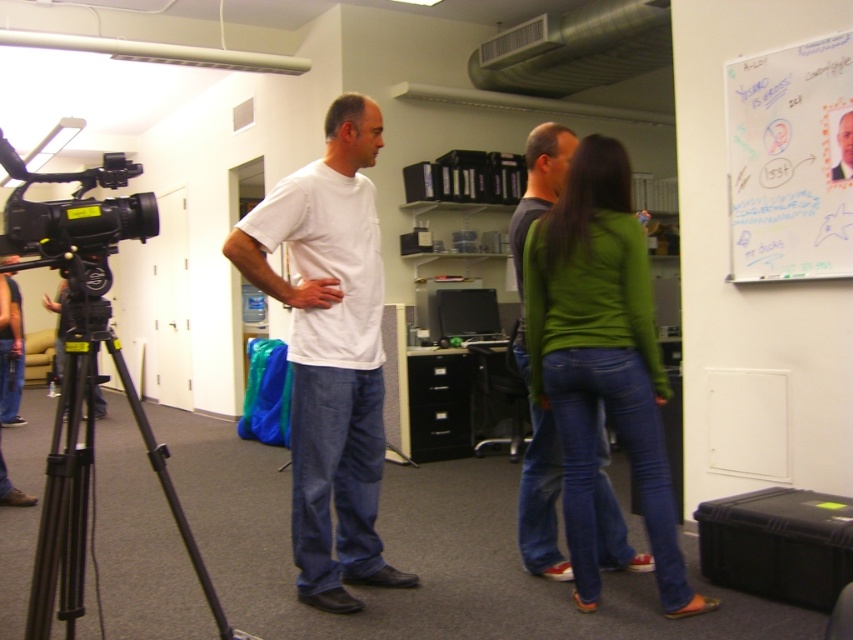
You are setting up a video call in this office and need to place the whiteboard at upper right and the black metal tripod at left in a way that the camera can capture both clearly. Based on their positions, which object is on the right side of the other?

The whiteboard at upper right is positioned on the right side of black metal tripod at left, so the whiteboard is on the right side of the tripod.

You are a photographer adjusting the focus of your camera. You need to focus on two points in the scene labeled as point [573,433] and point [84,529]. Which point is closer to the camera and should be in focus first?

Point [573,433] is closer to the camera than point [84,529], so it should be in focus first.